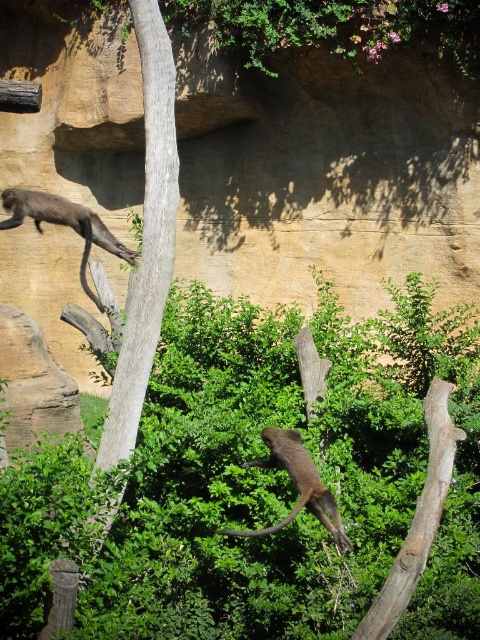
You are a zookeeper observing the monkeys in their enclosure. You notice the brown rough tree trunk at center and the brown furry monkey at center. Which object is positioned higher in the scene?

The brown rough tree trunk at center is positioned higher than the brown furry monkey at center in the scene.

You are a zookeeper trying to place a new feeding platform between the brown rough tree trunk at center and the brown furry monkey at center. The platform requires at least 2 meters of space between the two objects. Can the platform be placed there based on their widths?

The brown rough tree trunk at center is narrower than the brown furry monkey at center. However, the exact widths are not provided, so we cannot determine if the 2 meters requirement is met. More information is needed.

You are a zookeeper standing at the camera position and need to place a banana at the point marked as point (300, 477). The bananas you have can only be thrown up to 7 meters. Can you reach that point with your current bananas?

The point (300, 477) is 7.52 meters from the camera, which is beyond the 7 meters range of the bananas you can throw. Therefore, you cannot reach that point with your current bananas.